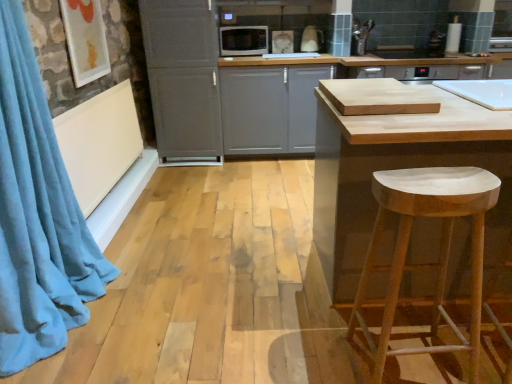
Question: Considering the positions of white glossy toaster at upper center, placed as the 2th appliance when sorted from left to right, and white matte stool at lower right in the image, is white glossy toaster at upper center, placed as the 2th appliance when sorted from left to right, taller or shorter than white matte stool at lower right?

Choices:
 (A) short
 (B) tall

Answer: (A)

Question: From the image's perspective, relative to white matte stool at lower right, is white glossy toaster at upper center, placed as the 2th appliance when sorted from left to right, above or below?

Choices:
 (A) above
 (B) below

Answer: (A)

Question: Which object is positioned closest to the natural wood cutting board at center?

Choices:
 (A) blue velvet curtain at left
 (B) white matte cabinet at center, which is counted as the 1th cabinetry, starting from the right
 (C) white glossy microwave at upper center, the first appliance from the left
 (D) white glossy toaster at upper center, which appears as the 1th appliance when viewed from the right
 (E) white matte stool at lower right

Answer: (E)

Question: Estimate the real-world distances between objects in this image. Which object is farther from the natural wood cutting board at center?

Choices:
 (A) white glossy microwave at upper center, the first appliance from the left
 (B) matte gray cabinet at center, the first cabinetry from the left
 (C) white matte stool at lower right
 (D) white glossy toaster at upper center, placed as the 2th appliance when sorted from left to right
 (E) blue velvet curtain at left

Answer: (D)